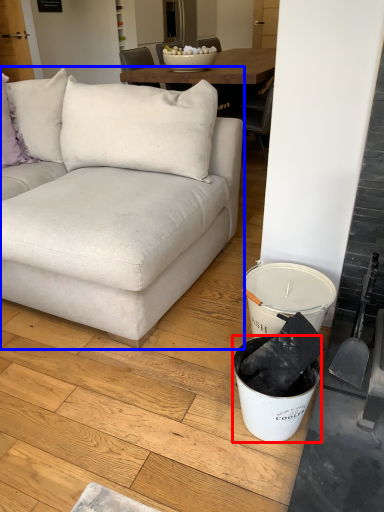
Question: Which point is further to the camera, bucket (highlighted by a red box) or studio couch (highlighted by a blue box)?

Choices:
 (A) bucket
 (B) studio couch

Answer: (A)